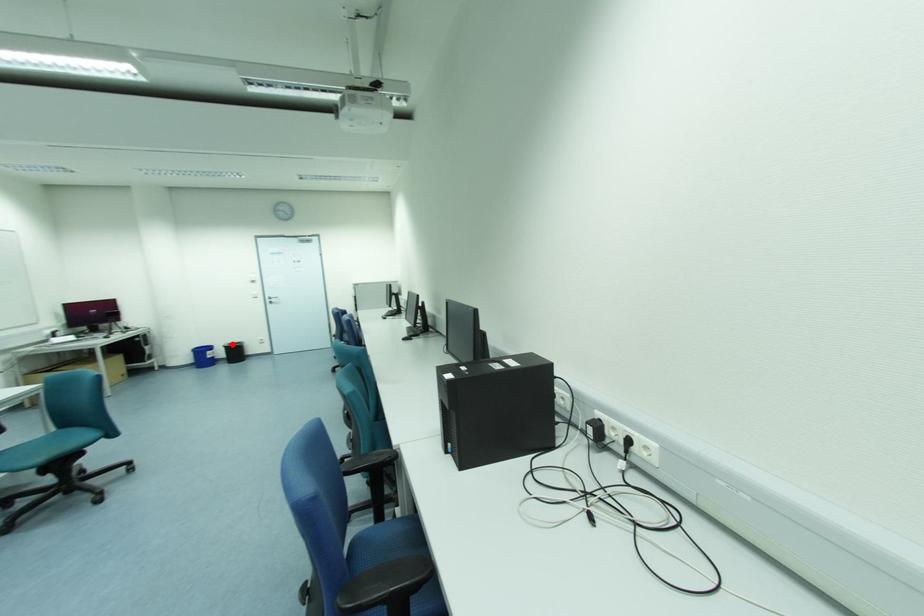
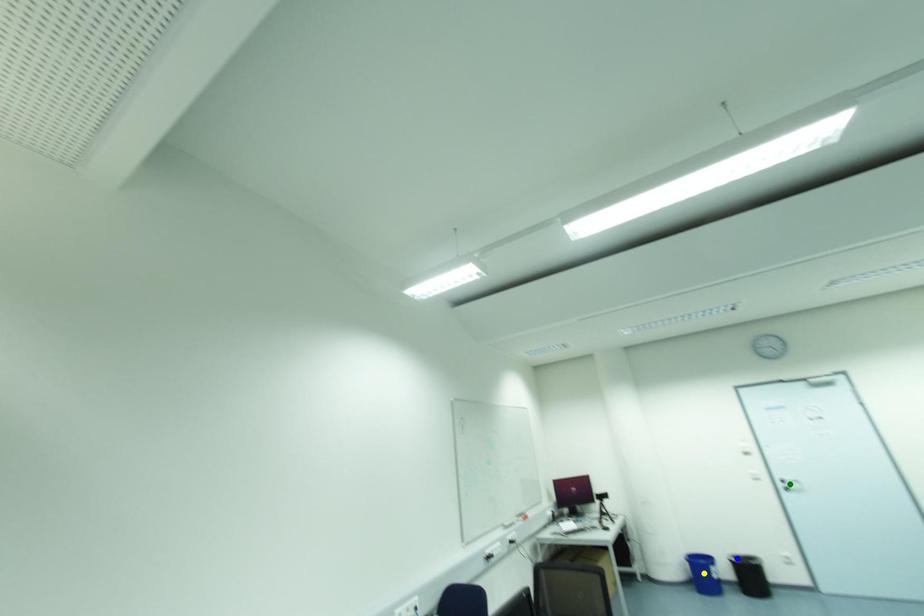
Question: I am providing you with two images of the same scene from different viewpoints. A red point is marked on the first image. You are given multiple points on the second image. Can you choose the point in image 2 that corresponds to the point in image 1?

Choices:
 (A) green point
 (B) yellow point
 (C) blue point

Answer: (C)